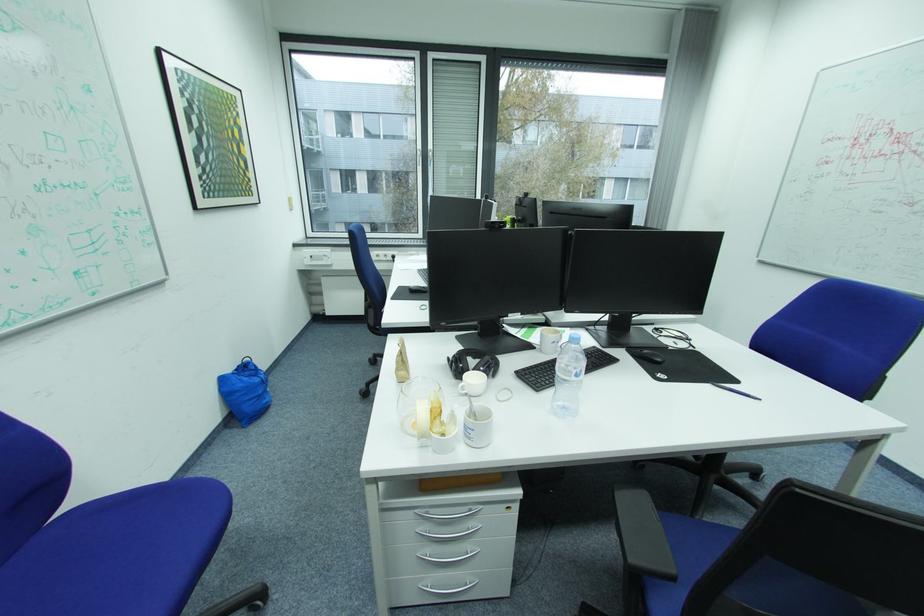
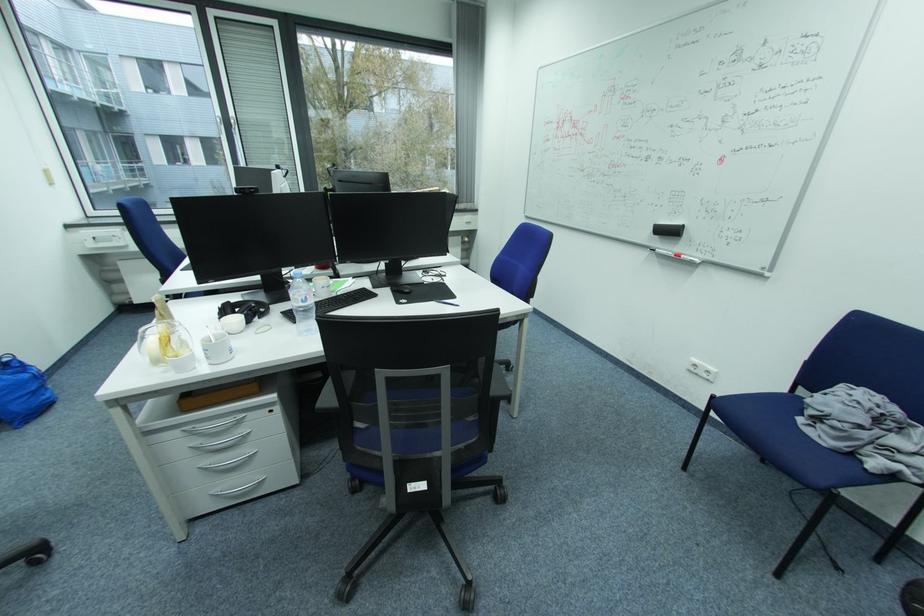
Find the pixel in the second image that matches (x=440, y=411) in the first image.

(169, 339)